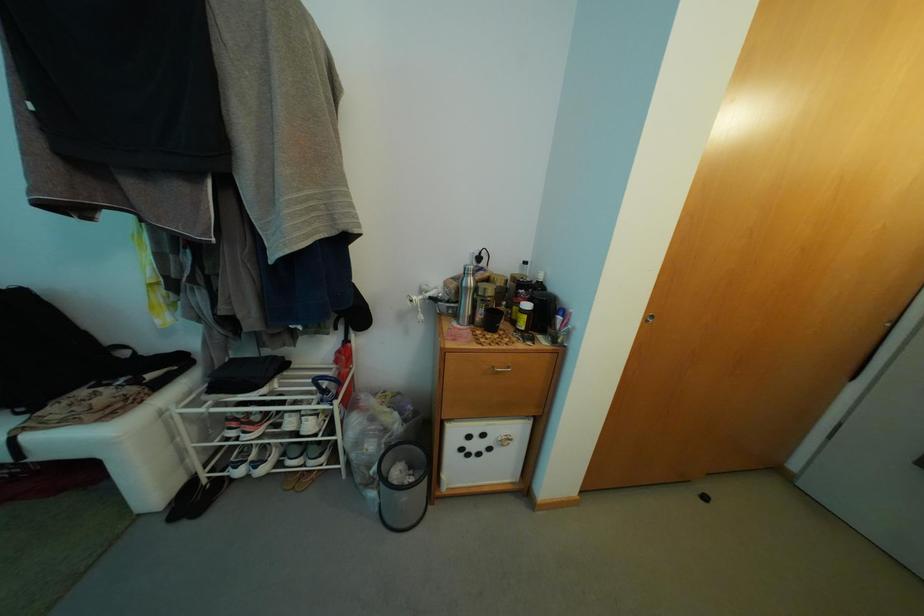
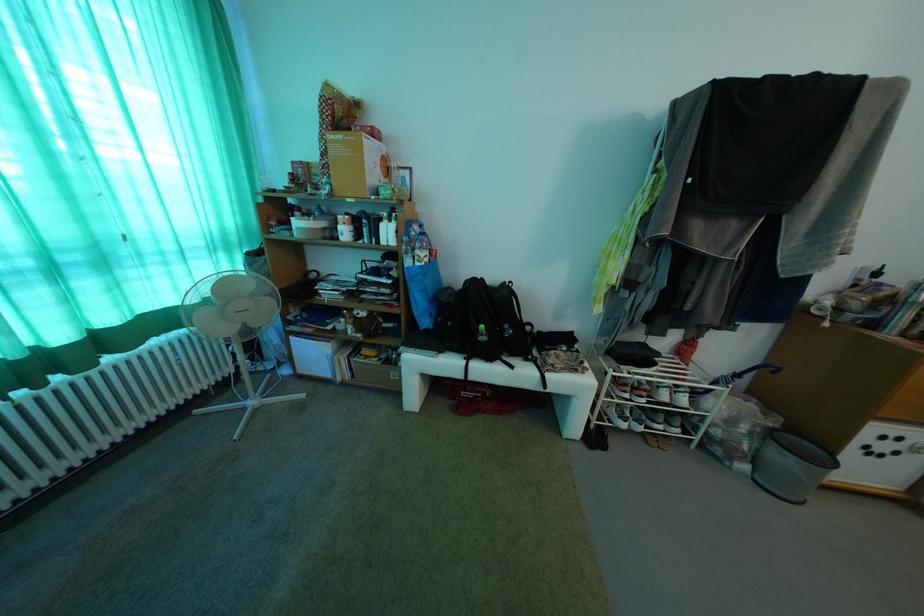
What movement of the cameraman would produce the second image?

The movement direction of the cameraman is left, backward.